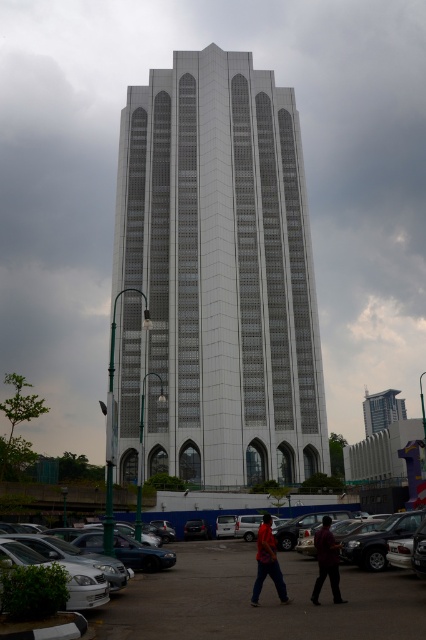
Is white glass tower at center wider than matte red shirt at center?

Indeed, white glass tower at center has a greater width compared to matte red shirt at center.

Who is positioned more to the left, white glass tower at center or matte red shirt at center?

From the viewer's perspective, white glass tower at center appears more on the left side.

Describe the element at coordinates (216, 276) in the screenshot. I see `white glass tower at center` at that location.

At what (x,y) coordinates should I click in order to perform the action: click on white glass tower at center. Please return your answer as a coordinate pair (x, y). The width and height of the screenshot is (426, 640). Looking at the image, I should click on (216, 276).

Between point (147, 579) and point (397, 392), which one is positioned behind?

The point (397, 392) is more distant.

Which of these two, dark gray asphalt parking lot at lower center or metallic glass skyscraper at center, stands shorter?

dark gray asphalt parking lot at lower center

Who is more forward, (180, 621) or (393, 396)?

Positioned in front is point (180, 621).

Find the location of `dark gray asphalt parking lot at lower center`. dark gray asphalt parking lot at lower center is located at coordinates (261, 600).

Does matte red shirt at center have a smaller size compared to metallic glass skyscraper at center?

Yes, matte red shirt at center is smaller than metallic glass skyscraper at center.

Can you confirm if matte red shirt at center is positioned to the right of metallic glass skyscraper at center?

Incorrect, matte red shirt at center is not on the right side of metallic glass skyscraper at center.

Does point (281, 600) come farther from viewer compared to point (383, 401)?

No, (281, 600) is in front of (383, 401).

Image resolution: width=426 pixels, height=640 pixels. What are the coordinates of `matte red shirt at center` in the screenshot? It's located at (267, 563).